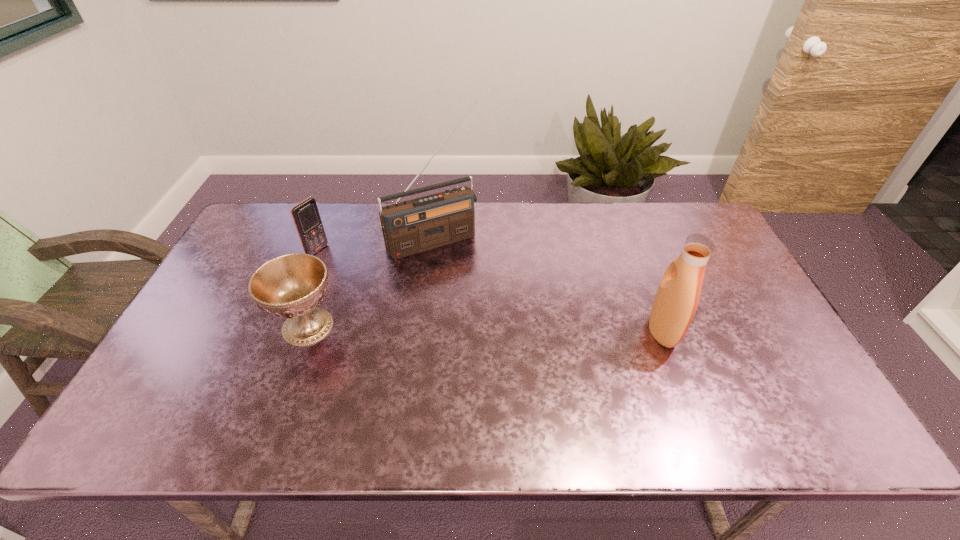
In order to click on vacant space at the near left corner of the desktop in this screenshot , I will do `click(205, 375)`.

Locate an element on the screen. The height and width of the screenshot is (540, 960). vacant space at the far right corner of the desktop is located at coordinates (700, 222).

Find the location of `vacant space in between the cellular telephone and the radio receiver`. vacant space in between the cellular telephone and the radio receiver is located at coordinates (375, 245).

Locate an element on the screen. The height and width of the screenshot is (540, 960). vacant space that's between the cellular telephone and the rightmost object is located at coordinates (490, 291).

Where is `free space between the cellular telephone and the detergent`? free space between the cellular telephone and the detergent is located at coordinates (490, 291).

Locate an element on the screen. vacant space that's between the third object from left to right and the cellular telephone is located at coordinates (375, 245).

Where is `free space between the rightmost object and the chalice`? Image resolution: width=960 pixels, height=540 pixels. free space between the rightmost object and the chalice is located at coordinates (485, 329).

You are a GUI agent. You are given a task and a screenshot of the screen. Output one action in this format:
    pyautogui.click(x=<x>, y=<y>)
    Task: Click on the free space between the radio receiver and the cellular telephone
    Image resolution: width=960 pixels, height=540 pixels.
    Given the screenshot: What is the action you would take?
    pyautogui.click(x=375, y=245)

Where is `vacant space that's between the second object from right to left and the detergent`? This screenshot has height=540, width=960. vacant space that's between the second object from right to left and the detergent is located at coordinates (548, 285).

Locate an element on the screen. This screenshot has height=540, width=960. free spot between the cellular telephone and the rightmost object is located at coordinates (490, 291).